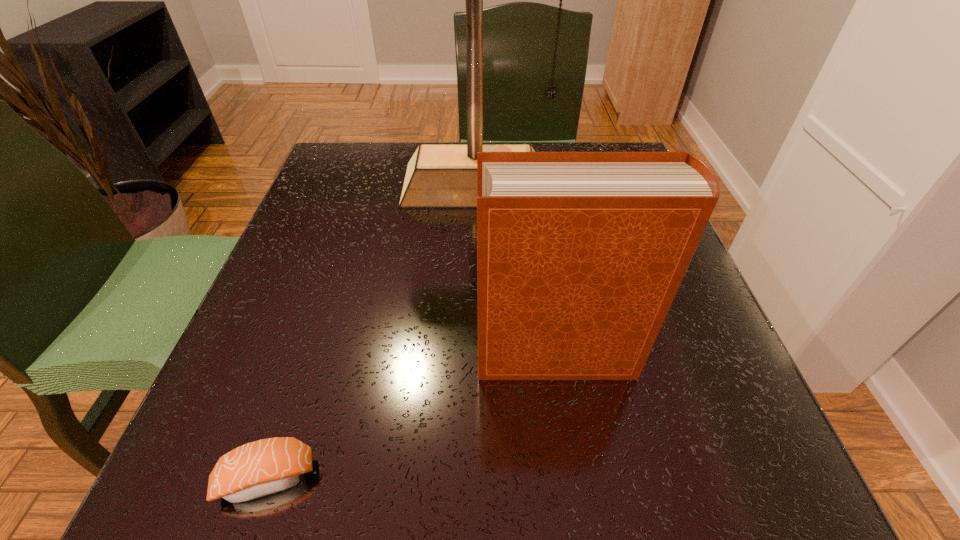
You are a GUI agent. You are given a task and a screenshot of the screen. Output one action in this format:
    pyautogui.click(x=<x>, y=<y>)
    Task: Click on the unoccupied area between the farthest object and the nearest object
    
    Given the screenshot: What is the action you would take?
    pyautogui.click(x=372, y=331)

Where is `vacant area between the shortest object and the tallest object`? This screenshot has width=960, height=540. vacant area between the shortest object and the tallest object is located at coordinates (372, 331).

Identify the location of empty space between the nearest object and the second nearest object. This screenshot has width=960, height=540. (413, 416).

Locate an element on the screen. This screenshot has height=540, width=960. vacant area that lies between the nearest object and the table lamp is located at coordinates (372, 331).

Where is `object that stands as the closest to the second farthest object`? Image resolution: width=960 pixels, height=540 pixels. object that stands as the closest to the second farthest object is located at coordinates [x=263, y=467].

Identify which object is located as the nearest to the sushi. Please provide its 2D coordinates. Your answer should be formatted as a tuple, i.e. [(x, y)], where the tuple contains the x and y coordinates of a point satisfying the conditions above.

[(580, 255)]

Locate an element on the screen. The image size is (960, 540). vacant space that satisfies the following two spatial constraints: 1. on the open cover of the second shortest object; 2. on the front side of the sushi is located at coordinates (576, 477).